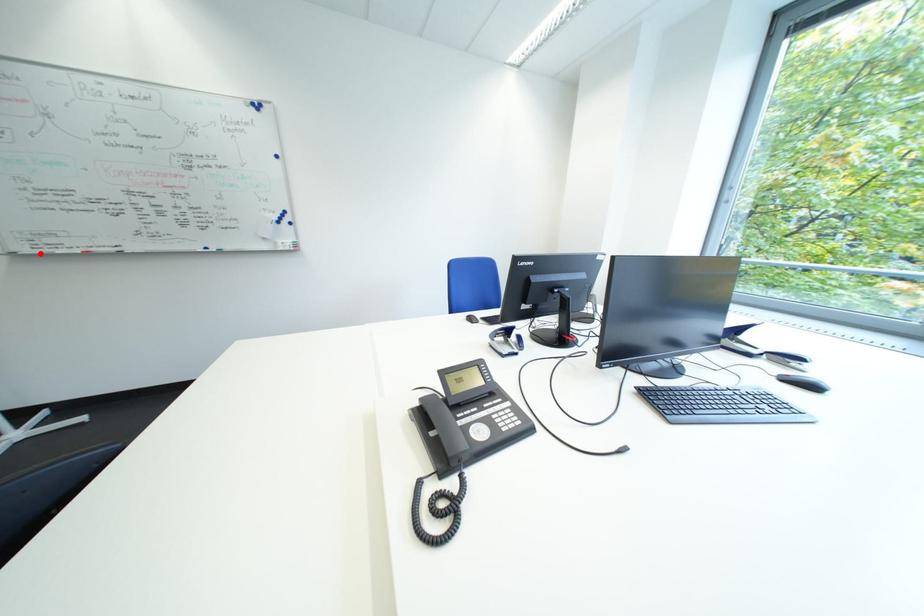
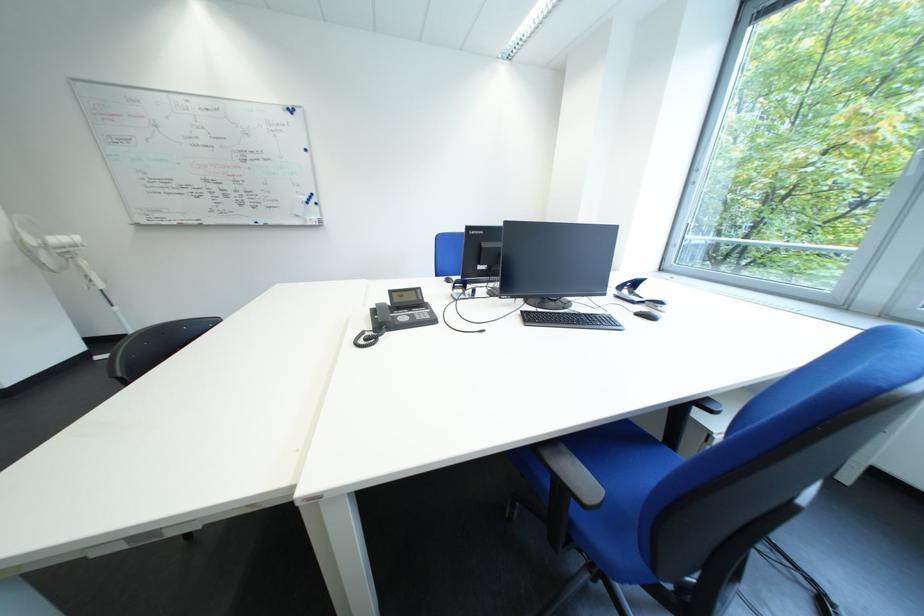
Question: A red point is marked in image1. In image2, is the corresponding 3D point closer to the camera or farther? Reply with the corresponding letter.

Choices:
 (A) The corresponding 3D point is closer.
 (B) The corresponding 3D point is farther.

Answer: (A)